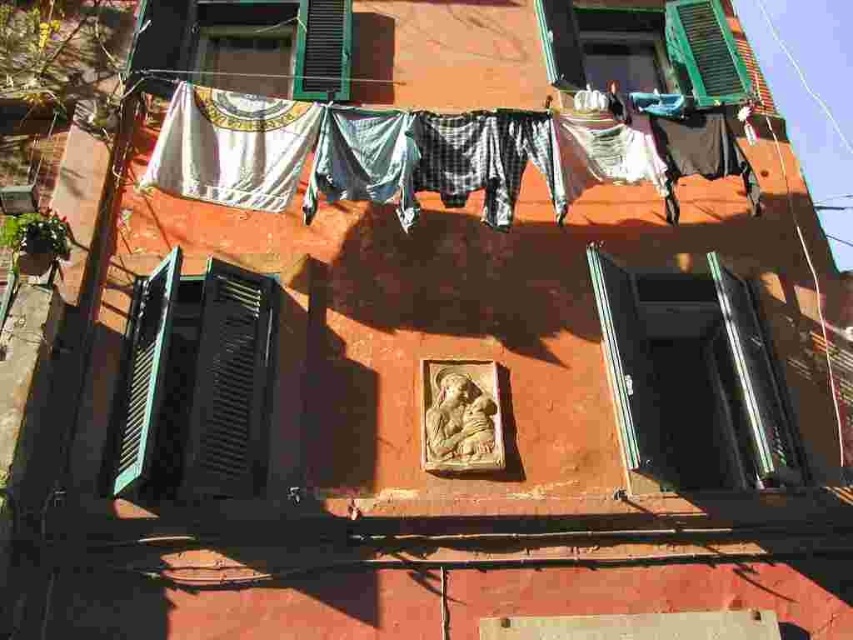
This screenshot has width=853, height=640. Describe the element at coordinates (196, 381) in the screenshot. I see `green matte window at left` at that location.

Is green matte window at left bigger than green matte shutter at upper center?

Indeed, green matte window at left has a larger size compared to green matte shutter at upper center.

What do you see at coordinates (196, 381) in the screenshot? This screenshot has width=853, height=640. I see `green matte window at left` at bounding box center [196, 381].

Where is `green matte window at left`? The width and height of the screenshot is (853, 640). green matte window at left is located at coordinates (196, 381).

Who is positioned more to the right, metallic silver window at center or green matte shutter at upper right?

green matte shutter at upper right is more to the right.

Consider the image. Can you confirm if metallic silver window at center is taller than green matte shutter at upper right?

Indeed, metallic silver window at center has a greater height compared to green matte shutter at upper right.

At what (x,y) coordinates should I click in order to perform the action: click on metallic silver window at center. Please return your answer as a coordinate pair (x, y). Looking at the image, I should click on (692, 378).

The image size is (853, 640). I want to click on metallic silver window at center, so click(x=692, y=378).

Does white fabric at upper center come in front of green matte shutter at upper right?

Yes, white fabric at upper center is closer to the viewer.

Is white fabric at upper center below green matte shutter at upper right?

Correct, white fabric at upper center is located below green matte shutter at upper right.

Between point (502, 129) and point (701, 42), which one is positioned in front?

Point (502, 129) is more forward.

This screenshot has height=640, width=853. What are the coordinates of `white fabric at upper center` in the screenshot? It's located at (421, 154).